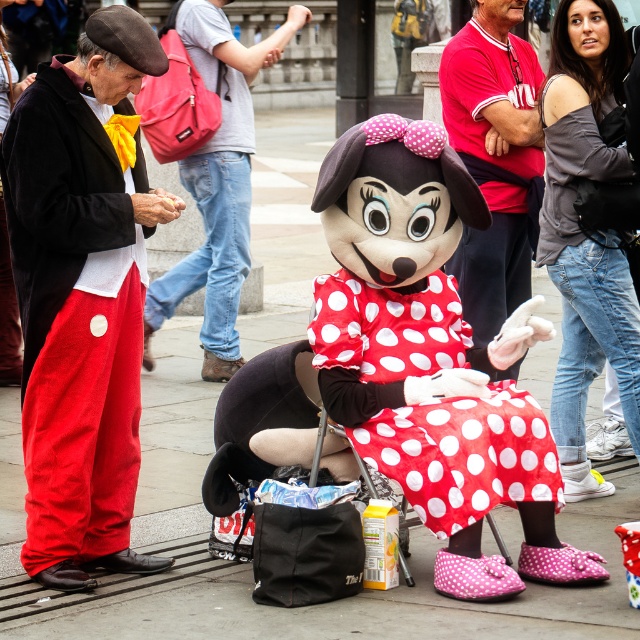
You are a photographer standing at the center of the street. You want to take a photo of both the red polka dot fabric dress at center and the red cotton shirt at center. The camera you are using has a maximum focus range of 10 feet. Will both items be in focus?

The red polka dot fabric dress at center is 9.39 feet away from the red cotton shirt at center. Since the maximum focus range is 10 feet, both items will be within the focus range and therefore in focus.

You are a photographer trying to capture a clear shot of both the red cotton shirt at center and the polka dot fabric minnie mouse at center. Which object should you focus on first to ensure it appears sharp in the foreground?

You should focus on the red cotton shirt at center first because it is above the polka dot fabric minnie mouse at center, making it closer to the camera and thus the foreground.

You are a photographer trying to capture a closeup shot of the red polka dot fabric dress at center. The camera you are using has a very narrow field of view. Based on the scene, can you determine if the black bag placed on the ground and the carton of orange juice are within the frame of the closeup shot?

The red polka dot fabric dress at center is located at point (464, 454). Since the camera has a narrow field of view focused on the dress, the black bag and orange juice carton, which are positioned in front of Minnie Mouse, are likely outside the closeup frame.